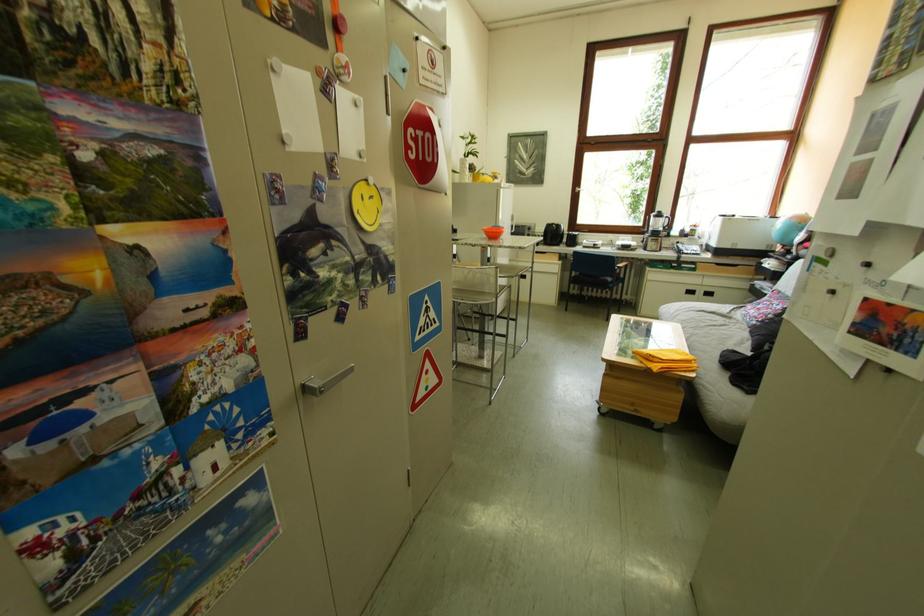
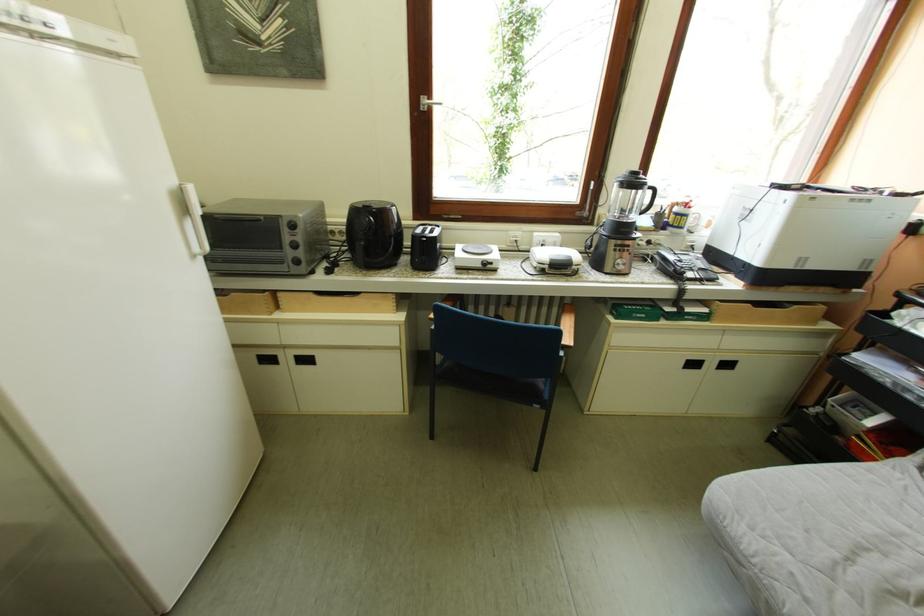
From the picture: In a continuous first-person perspective shot, in which direction is the camera moving?

The cameraman walked toward right, forward.